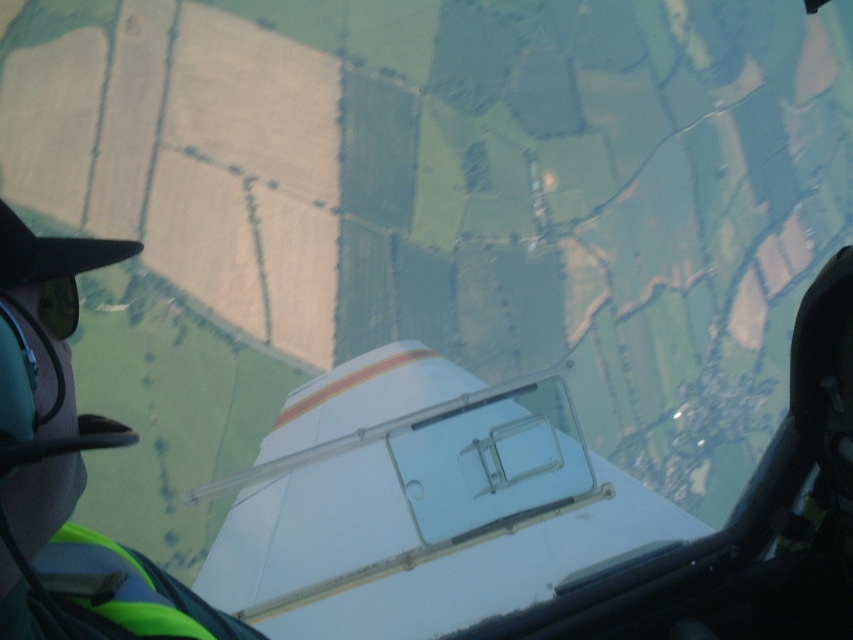
You are a passenger in the aircraft and want to see the pilot. Which object is closer to the cockpit window? The green fabric pilot at left or the green matte goggles at lower left?

The green matte goggles at lower left are closer to the cockpit window because the green fabric pilot at left is positioned under them.

You are a passenger on the aircraft and want to know if the green fabric pilot at left is wearing the green matte goggles at lower left. Based on their positions, can you determine if the goggles are part of the pilot?

The green fabric pilot at left is closer to the viewer than the green matte goggles at lower left, so the goggles are likely not part of the pilot since they are positioned further away.

You are a pilot sitting in the cockpit of the white glossy airplane at center. You need to check the position of your aircraft relative to a control tower located at coordinate point 0.781, 0.585. Is your aircraft aligned with the control tower?

The white glossy airplane at center is located exactly at the control tower coordinates (x=498, y=499), so yes, the aircraft is aligned with the control tower.